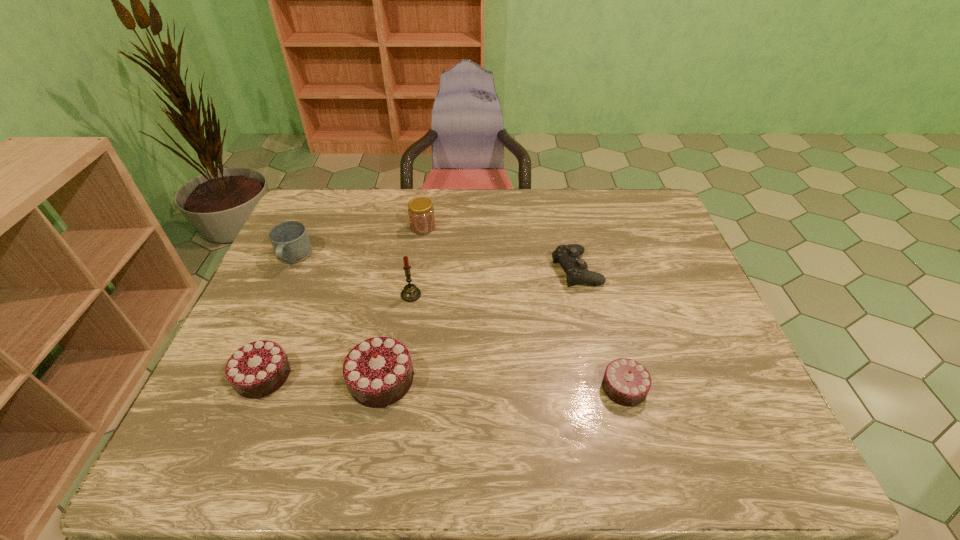
In the image, there is a desktop. Where is `vacant space at the right edge`? Image resolution: width=960 pixels, height=540 pixels. vacant space at the right edge is located at coordinates (656, 279).

Identify the location of vacant space at the far left corner. Image resolution: width=960 pixels, height=540 pixels. (310, 193).

The image size is (960, 540). What are the coordinates of `free space at the far right corner of the desktop` in the screenshot? It's located at (638, 192).

Identify the location of vacant region at the near right corner of the desktop. Image resolution: width=960 pixels, height=540 pixels. [713, 390].

At what (x,y) coordinates should I click in order to perform the action: click on unoccupied area between the mug and the jam. Please return your answer as a coordinate pair (x, y). Looking at the image, I should click on (358, 242).

Where is `blank region between the mug and the second shortest chocolate cake`? blank region between the mug and the second shortest chocolate cake is located at coordinates tap(278, 316).

Identify the location of empty space that is in between the control and the rightmost chocolate cake. (600, 328).

Where is `free space between the leftmost chocolate cake and the tallest chocolate cake`? Image resolution: width=960 pixels, height=540 pixels. free space between the leftmost chocolate cake and the tallest chocolate cake is located at coordinates (323, 378).

Find the location of a particular element. free space between the control and the tallest chocolate cake is located at coordinates (479, 325).

You are a GUI agent. You are given a task and a screenshot of the screen. Output one action in this format:
    pyautogui.click(x=<x>, y=<y>)
    Task: Click on the vacant area that lies between the mug and the leftmost chocolate cake
    This screenshot has width=960, height=540.
    Given the screenshot: What is the action you would take?
    pyautogui.click(x=278, y=316)